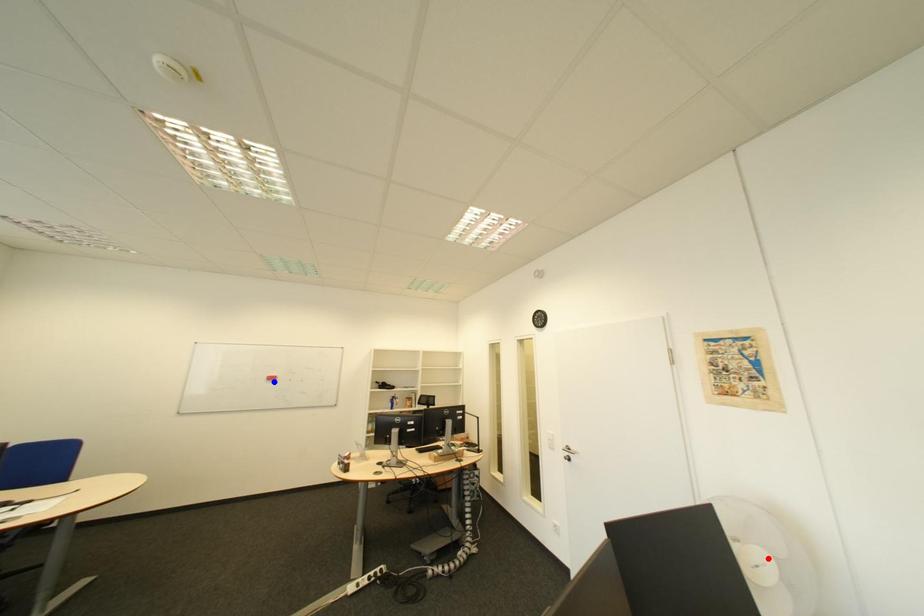
Question: In the image, two points are highlighted. Which point is nearer to the camera? Reply with the corresponding letter.

Choices:
 (A) blue point
 (B) red point

Answer: (B)